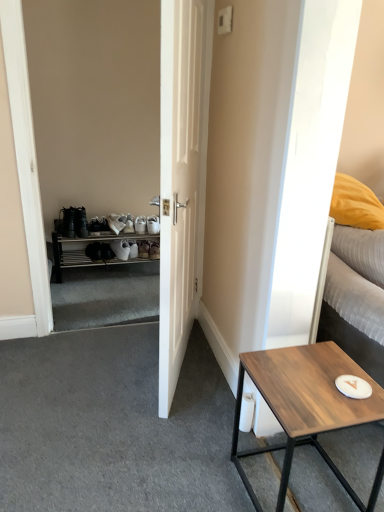
Describe the element at coordinates (356, 297) in the screenshot. I see `white textured bed at right` at that location.

Describe the element at coordinates (96, 254) in the screenshot. I see `white plastic shoe rack at left` at that location.

What is the approximate width of white plastic shoe rack at left?

white plastic shoe rack at left is 13.16 inches in width.

What are the coordinates of `wooden table at lower right` in the screenshot? It's located at (307, 407).

Measure the distance between point (292, 366) and camera.

The depth of point (292, 366) is 1.34 meters.

At what (x,y) coordinates should I click in order to perform the action: click on white textured bed at right. Please return your answer as a coordinate pair (x, y). Image resolution: width=384 pixels, height=512 pixels. Looking at the image, I should click on (356, 297).

Is white plastic shoe rack at left wider than wooden table at lower right?

Incorrect, the width of white plastic shoe rack at left does not surpass that of wooden table at lower right.

From the image's perspective, is white plastic shoe rack at left beneath wooden table at lower right?

No.

Does white plastic shoe rack at left turn towards wooden table at lower right?

Yes, white plastic shoe rack at left is aimed at wooden table at lower right.

Considering the sizes of objects white plastic shoe rack at left and wooden table at lower right in the image provided, who is smaller, white plastic shoe rack at left or wooden table at lower right?

With smaller size is wooden table at lower right.

Between white textured bed at right and white matte door at center, which one appears on the right side from the viewer's perspective?

white textured bed at right is more to the right.

Which of these two, white textured bed at right or white matte door at center, is thinner?

white matte door at center is thinner.

Could white matte door at center be considered to be inside white textured bed at right?

That's incorrect, white matte door at center is not inside white textured bed at right.

Considering the relative sizes of white textured bed at right and white matte door at center in the image provided, is white textured bed at right bigger than white matte door at center?

No, white textured bed at right is not bigger than white matte door at center.

Based on their sizes in the image, would you say white matte door at center is bigger or smaller than white textured bed at right?

Considering their sizes, white matte door at center takes up more space than white textured bed at right.

Is white matte door at center outside of white textured bed at right?

That's correct, white matte door at center is outside of white textured bed at right.

Measure the distance between white matte door at center and white textured bed at right.

They are 28.13 inches apart.

From the image's perspective, is white matte door at center below white textured bed at right?

No, from the image's perspective, white matte door at center is not beneath white textured bed at right.

Are white matte door at center and white plastic shoe rack at left making contact?

No, white matte door at center is not in contact with white plastic shoe rack at left.

Can you confirm if white matte door at center is bigger than white plastic shoe rack at left?

Correct, white matte door at center is larger in size than white plastic shoe rack at left.

Is white plastic shoe rack at left at the back of white matte door at center?

No, white matte door at center's orientation is not away from white plastic shoe rack at left.

Which is more to the right, white matte door at center or wooden table at lower right?

wooden table at lower right.

Is white matte door at center positioned beyond the bounds of wooden table at lower right?

Yes, white matte door at center is located beyond the bounds of wooden table at lower right.

At what (x,y) coordinates should I click in order to perform the action: click on coffee table below the white matte door at center (from a real-world perspective). Please return your answer as a coordinate pair (x, y). Image resolution: width=384 pixels, height=512 pixels. Looking at the image, I should click on (307, 407).

Considering the points (175, 22) and (280, 483), which point is in front, point (175, 22) or point (280, 483)?

The point (175, 22) is closer to the camera.

Considering the relative sizes of wooden table at lower right and white plastic shoe rack at left in the image provided, is wooden table at lower right thinner than white plastic shoe rack at left?

In fact, wooden table at lower right might be wider than white plastic shoe rack at left.

Is point (334, 425) farther from camera compared to point (99, 239)?

No, (334, 425) is in front of (99, 239).

Would you say wooden table at lower right is to the left or to the right of white plastic shoe rack at left in the picture?

Clearly, wooden table at lower right is on the right of white plastic shoe rack at left in the image.

Identify the location of coffee table in front of the white plastic shoe rack at left. This screenshot has height=512, width=384. (307, 407).

Is wooden table at lower right next to white matte door at center?

No, wooden table at lower right is not beside white matte door at center.

Visually, is wooden table at lower right positioned to the left or to the right of white matte door at center?

wooden table at lower right is to the right of white matte door at center.

Which of these two, wooden table at lower right or white matte door at center, is wider?

wooden table at lower right is wider.

This screenshot has width=384, height=512. In order to click on cabinetry that is above the wooden table at lower right (from the image's perspective) in this screenshot , I will do `click(96, 254)`.

Where is `bed behind the white matte door at center`? bed behind the white matte door at center is located at coordinates (356, 297).

When comparing their distances from white textured bed at right, does white matte door at center or white plastic shoe rack at left seem closer?

white matte door at center.

Based on their spatial positions, is white plastic shoe rack at left or white matte door at center closer to white textured bed at right?

Based on the image, white matte door at center appears to be nearer to white textured bed at right.

Looking at this image, estimate the real-world distances between objects in this image. Which object is further from white plastic shoe rack at left, white textured bed at right or white matte door at center?

Based on the image, white textured bed at right appears to be further to white plastic shoe rack at left.

From the image, which object appears to be farther from white matte door at center, wooden table at lower right or white plastic shoe rack at left?

white plastic shoe rack at left is further to white matte door at center.

Based on their spatial positions, is white textured bed at right or white plastic shoe rack at left closer to white matte door at center?

white textured bed at right.

Based on their spatial positions, is white textured bed at right or wooden table at lower right further from white matte door at center?

Based on the image, wooden table at lower right appears to be further to white matte door at center.

Which object lies further to the anchor point white plastic shoe rack at left, wooden table at lower right or white matte door at center?

wooden table at lower right is positioned further to the anchor white plastic shoe rack at left.

Which object lies nearer to the anchor point white plastic shoe rack at left, white textured bed at right or wooden table at lower right?

white textured bed at right is closer to white plastic shoe rack at left.

Identify the location of bed between wooden table at lower right and white plastic shoe rack at left in the front-back direction. (356, 297).

What are the coordinates of `bed between white matte door at center and wooden table at lower right vertically` in the screenshot? It's located at (356, 297).

You are a GUI agent. You are given a task and a screenshot of the screen. Output one action in this format:
    pyautogui.click(x=<x>, y=<y>)
    Task: Click on the bed between white matte door at center and white plastic shoe rack at left in the front-back direction
    This screenshot has height=512, width=384.
    Given the screenshot: What is the action you would take?
    pyautogui.click(x=356, y=297)

Image resolution: width=384 pixels, height=512 pixels. Find the location of `door located between wooden table at lower right and white plastic shoe rack at left in the depth direction`. door located between wooden table at lower right and white plastic shoe rack at left in the depth direction is located at coordinates coord(182,178).